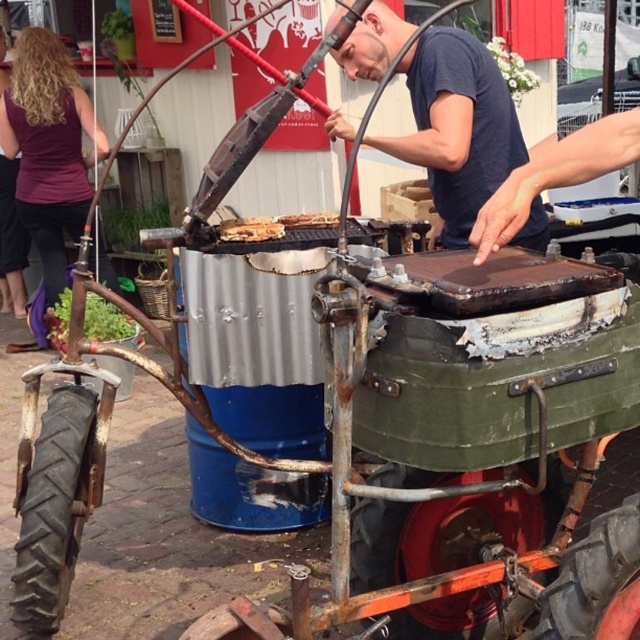
Question: Based on their relative distances, which object is farther from the purple fabric at left?

Choices:
 (A) dark blue shirt at center
 (B) brown wooden plank at center

Answer: (A)

Question: Which of the following is the farthest from the observer?

Choices:
 (A) brown wooden plank at center
 (B) dark blue shirt at center
 (C) brown matte grill at center

Answer: (C)

Question: Does purple fabric at left appear on the left side of brown matte grill at center?

Choices:
 (A) no
 (B) yes

Answer: (B)

Question: Which of the following is the closest to the observer?

Choices:
 (A) (300, 227)
 (B) (227, 221)
 (C) (29, 109)

Answer: (B)

Question: Can you confirm if purple fabric at left is bigger than brown wooden plank at center?

Choices:
 (A) no
 (B) yes

Answer: (B)

Question: Does purple fabric at left have a lesser width compared to brown wooden plank at center?

Choices:
 (A) no
 (B) yes

Answer: (A)